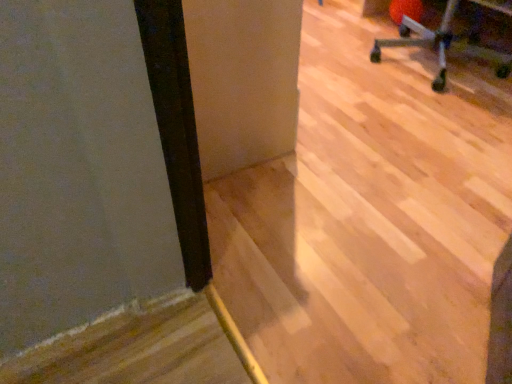
This screenshot has height=384, width=512. Find the location of `vacant space underneath metallic silver chair at upper right (from a real-world perspective)`. vacant space underneath metallic silver chair at upper right (from a real-world perspective) is located at coordinates (421, 59).